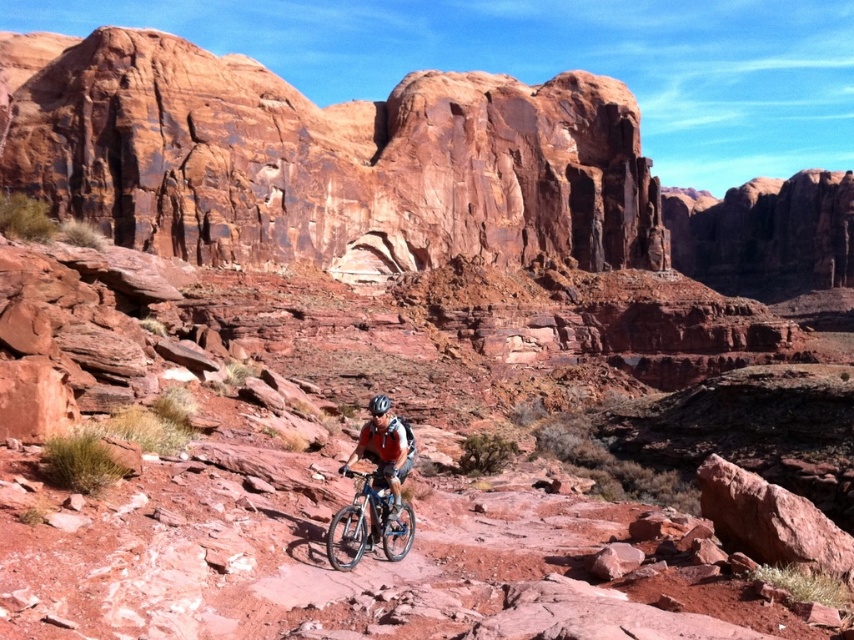
Question: Does rustic sandstone rock formation at center appear over shiny metallic bicycle at center?

Choices:
 (A) yes
 (B) no

Answer: (A)

Question: Which point is farther from the camera taking this photo?

Choices:
 (A) (237, 236)
 (B) (384, 401)
 (C) (413, 440)

Answer: (A)

Question: Which point is farther to the camera?

Choices:
 (A) matte orange shirt at center
 (B) shiny metallic bicycle at center
 (C) rustic sandstone rock formation at center

Answer: (C)

Question: Observing the image, what is the correct spatial positioning of rustic sandstone rock formation at center in reference to matte orange shirt at center?

Choices:
 (A) left
 (B) right

Answer: (A)

Question: Does rustic sandstone rock formation at center appear on the left side of shiny metallic bicycle at center?

Choices:
 (A) no
 (B) yes

Answer: (B)

Question: Which point is closer to the camera?

Choices:
 (A) shiny metallic bicycle at center
 (B) rustic sandstone rock formation at center
 (C) shiny silver helmet at center
 (D) matte orange shirt at center

Answer: (A)